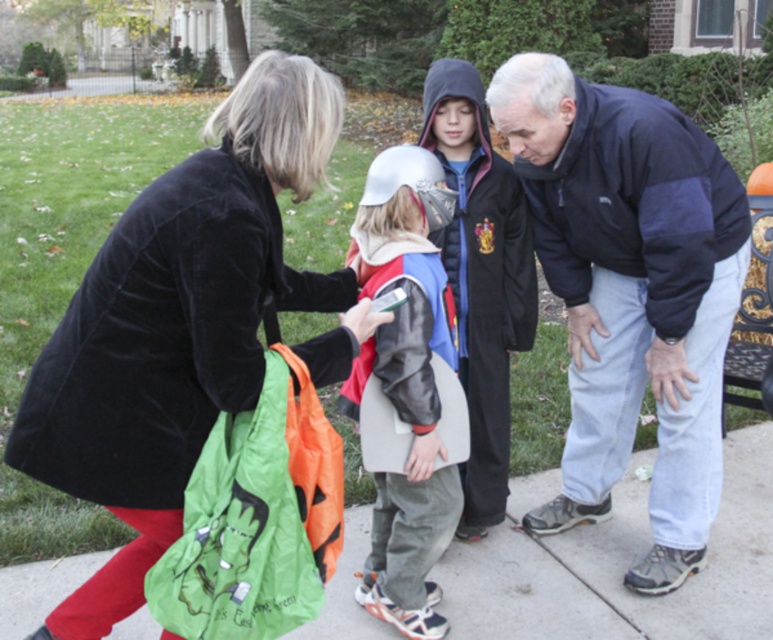
Question: Among these objects, which one is nearest to the camera?

Choices:
 (A) leather jacket at center
 (B) concrete sidewalk at lower center
 (C) dark blue fleece jacket at center

Answer: (A)

Question: Is dark blue fleece jacket at center positioned before leather jacket at center?

Choices:
 (A) no
 (B) yes

Answer: (A)

Question: Can you confirm if concrete sidewalk at lower center is positioned to the right of leather jacket at center?

Choices:
 (A) no
 (B) yes

Answer: (B)

Question: Is velvet black coat at center positioned behind concrete sidewalk at lower center?

Choices:
 (A) no
 (B) yes

Answer: (A)

Question: Which object is positioned farthest from the leather jacket at center?

Choices:
 (A) concrete sidewalk at lower center
 (B) dark blue fleece jacket at center
 (C) velvet black coat at center

Answer: (A)

Question: Estimate the real-world distances between objects in this image. Which object is farther from the dark blue fleece jacket at center?

Choices:
 (A) concrete sidewalk at lower center
 (B) velvet black coat at center

Answer: (B)